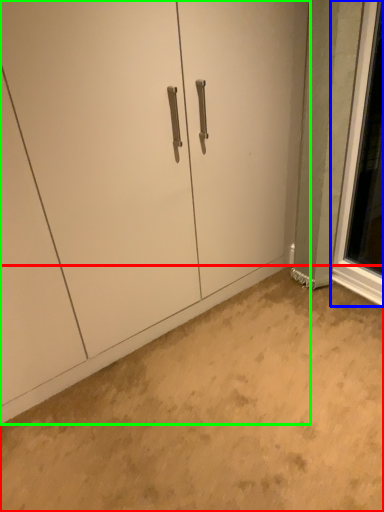
Question: Estimate the real-world distances between objects in this image. Which object is closer to concrete (highlighted by a red box), window (highlighted by a blue box) or door (highlighted by a green box)?

Choices:
 (A) window
 (B) door

Answer: (B)